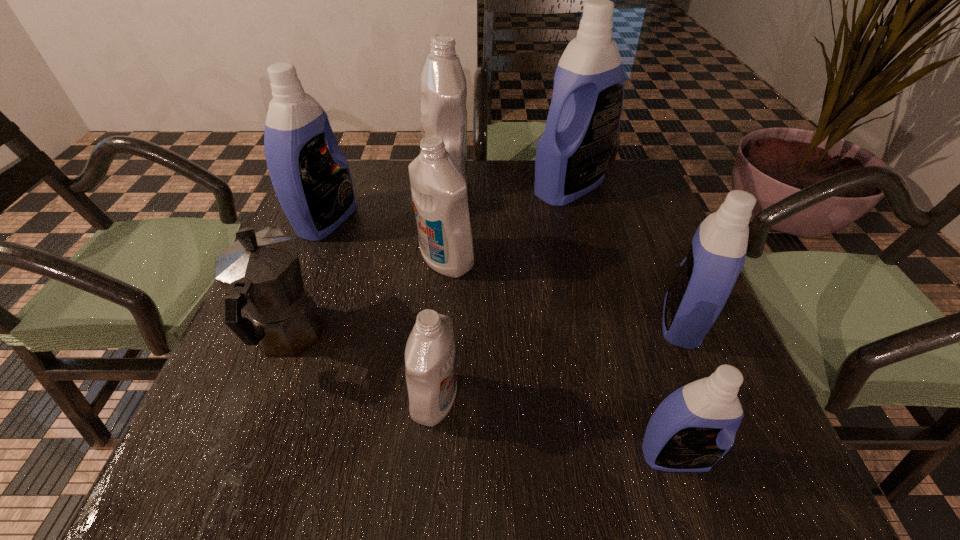
Locate an element on the screen. This screenshot has width=960, height=540. the smallest white detergent is located at coordinates (430, 360).

Identify the location of the nearest blue detergent. point(695,426).

The width and height of the screenshot is (960, 540). What are the coordinates of `the smallest blue detergent` in the screenshot? It's located at (695, 426).

Locate an element on the screen. free region located on the front of the tallest detergent is located at coordinates (599, 303).

Locate an element on the screen. This screenshot has height=540, width=960. free space located on the right of the farthest white detergent is located at coordinates (598, 182).

Locate an element on the screen. This screenshot has height=540, width=960. vacant space situated 0.220m on the front of the second biggest blue detergent is located at coordinates (288, 316).

Find the location of `vacant area located 0.340m on the back of the second biggest white detergent`. vacant area located 0.340m on the back of the second biggest white detergent is located at coordinates (454, 165).

The height and width of the screenshot is (540, 960). I want to click on free point located on the left of the third farthest blue detergent, so click(465, 322).

What are the coordinates of `vacant region located on the pouring side of the coffeepot` in the screenshot? It's located at (346, 188).

The width and height of the screenshot is (960, 540). In order to click on free space located on the pouring side of the coffeepot in this screenshot , I will do `click(336, 212)`.